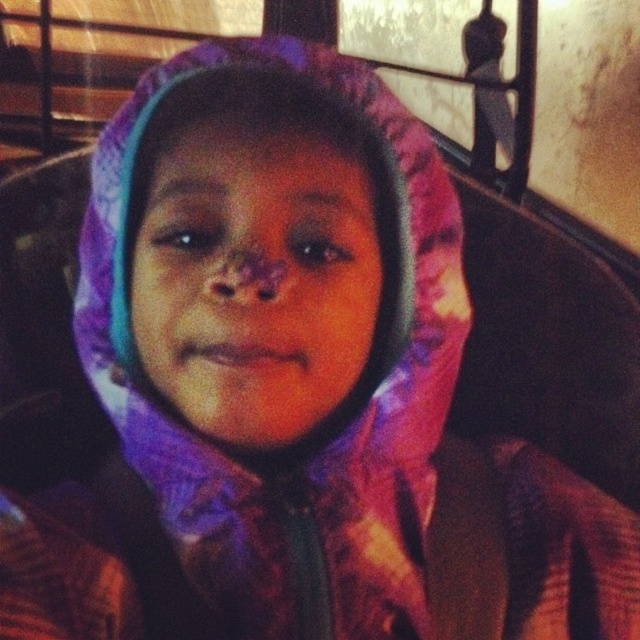
Question: Does purple tie-dye hoodie at center lie in front of multicolored fabric hood at center?

Choices:
 (A) yes
 (B) no

Answer: (B)

Question: Among these points, which one is farthest from the camera?

Choices:
 (A) (337, 81)
 (B) (173, 321)

Answer: (A)

Question: Which point appears closest to the camera in this image?

Choices:
 (A) (349, 156)
 (B) (396, 467)

Answer: (A)

Question: Is purple tie-dye hoodie at center below multicolored fabric hood at center?

Choices:
 (A) no
 (B) yes

Answer: (B)

Question: From the image, what is the correct spatial relationship of purple tie-dye hoodie at center in relation to multicolored fabric hood at center?

Choices:
 (A) left
 (B) right

Answer: (B)

Question: Which point is farther to the camera?

Choices:
 (A) (266, 275)
 (B) (339, 467)

Answer: (B)